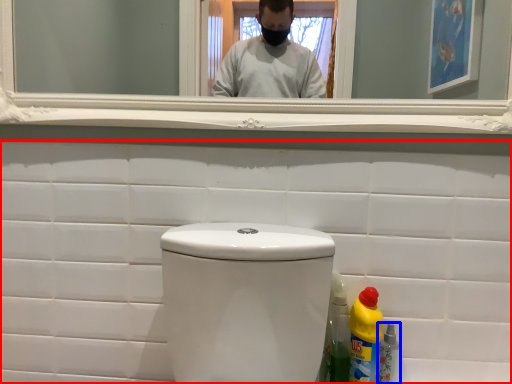
Question: Among these objects, which one is nearest to the camera, porcelain (highlighted by a red box) or bottle (highlighted by a blue box)?

Choices:
 (A) porcelain
 (B) bottle

Answer: (A)